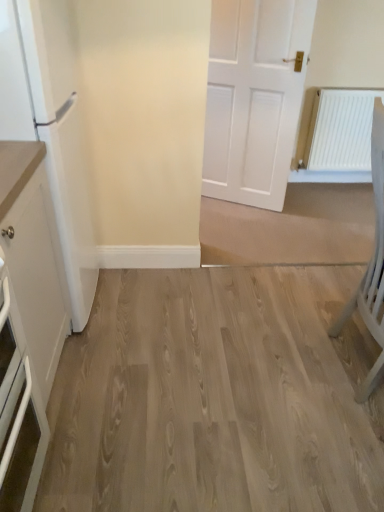
Where is `vacant space underneath light gray wooden chair at right (from a real-world perspective)`? vacant space underneath light gray wooden chair at right (from a real-world perspective) is located at coordinates (344, 366).